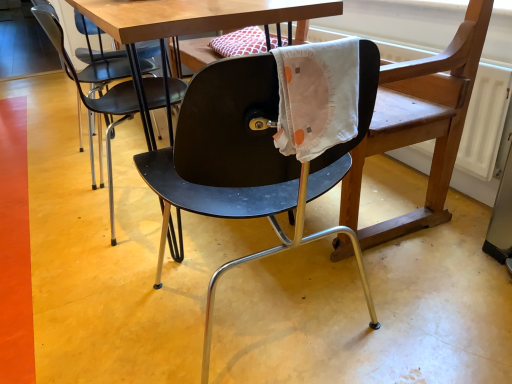
Image resolution: width=512 pixels, height=384 pixels. I want to click on vacant region to the left of matte black chair at center, acting as the second chair starting from the right, so click(55, 207).